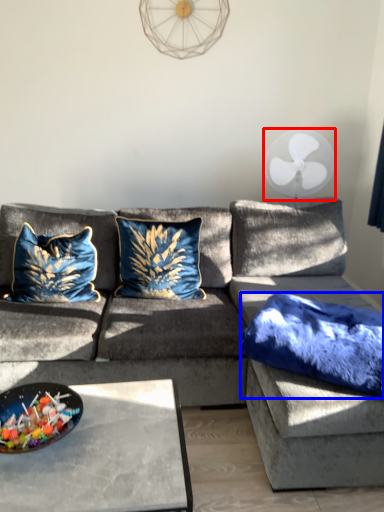
Question: Which of the following is the farthest to the observer, mechanical fan (highlighted by a red box) or pillow (highlighted by a blue box)?

Choices:
 (A) mechanical fan
 (B) pillow

Answer: (A)